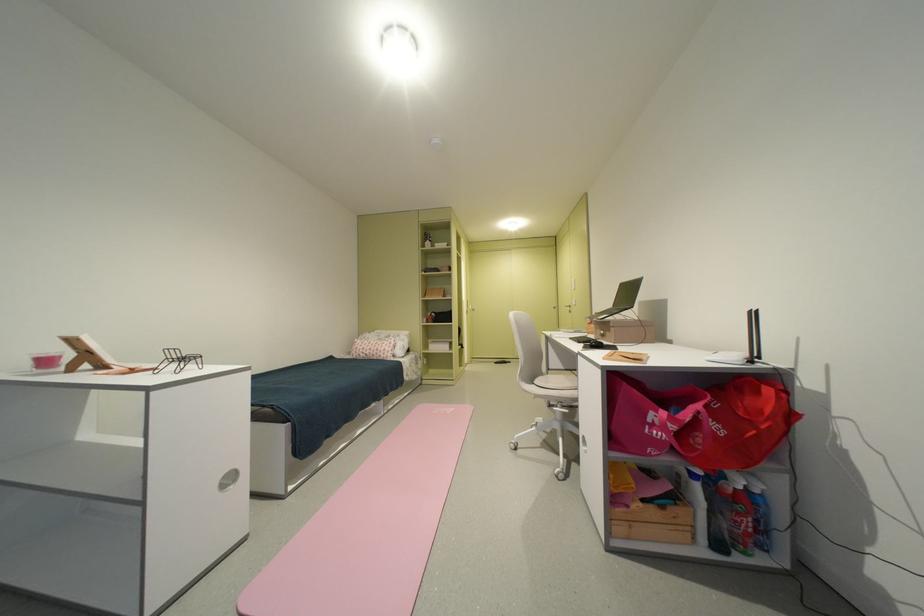
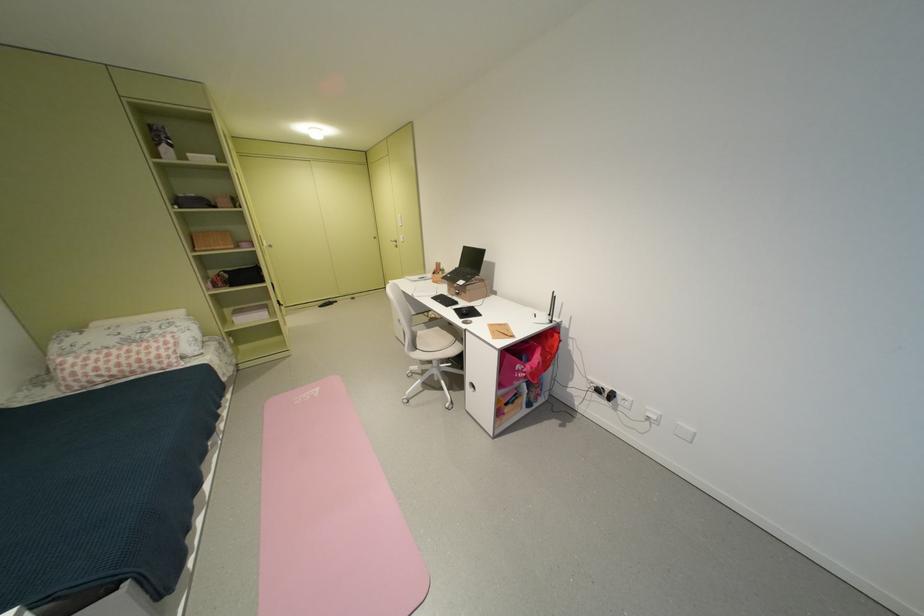
Locate, in the second image, the point that corresponds to (x=390, y=352) in the first image.

(159, 362)